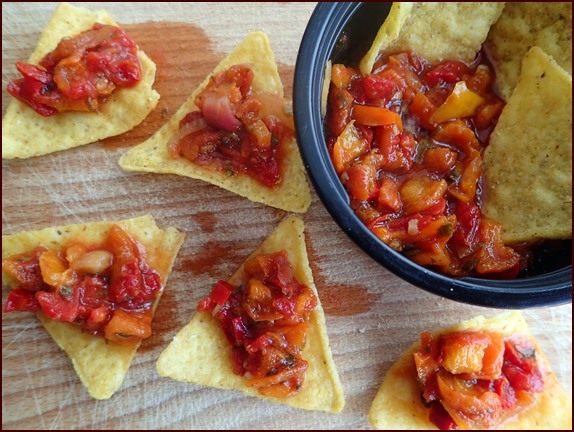
Find the location of a particular element. The width and height of the screenshot is (574, 432). wooden surface is located at coordinates (37, 188).